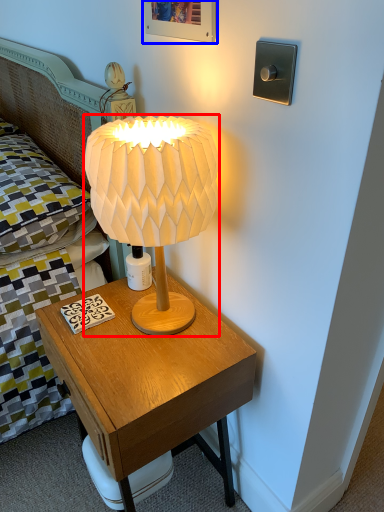
Question: Among these objects, which one is farthest to the camera, lamp (highlighted by a red box) or picture frame (highlighted by a blue box)?

Choices:
 (A) lamp
 (B) picture frame

Answer: (B)